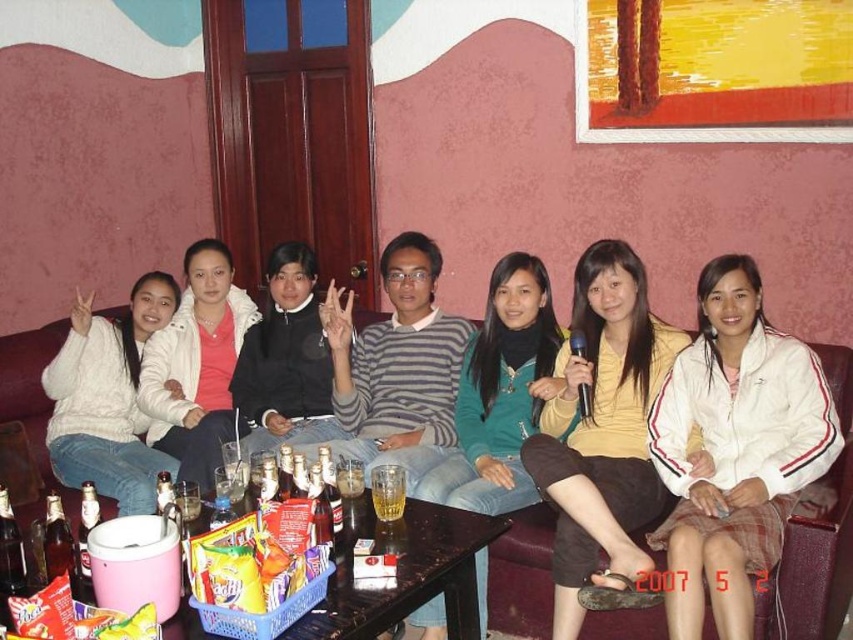
Is teal sweater at center taller than wooden table at center?

Yes.

Which is behind, point (541, 355) or point (305, 637)?

The point (541, 355) is more distant.

This screenshot has height=640, width=853. I want to click on teal sweater at center, so click(x=502, y=392).

The height and width of the screenshot is (640, 853). Identify the location of teal sweater at center. (502, 392).

Is point (685, 637) positioned in front of point (62, 449)?

Yes, it is.

The width and height of the screenshot is (853, 640). Identify the location of white fabric jacket at center. (735, 449).

Where is `white fabric jacket at center`? The width and height of the screenshot is (853, 640). white fabric jacket at center is located at coordinates (735, 449).

Does brown leather couch at center appear on the left side of wooden table at center?

In fact, brown leather couch at center is to the right of wooden table at center.

Does brown leather couch at center come in front of wooden table at center?

No.

Is point (44, 342) farther from camera compared to point (486, 524)?

That is True.

Locate an element on the screen. brown leather couch at center is located at coordinates (819, 556).